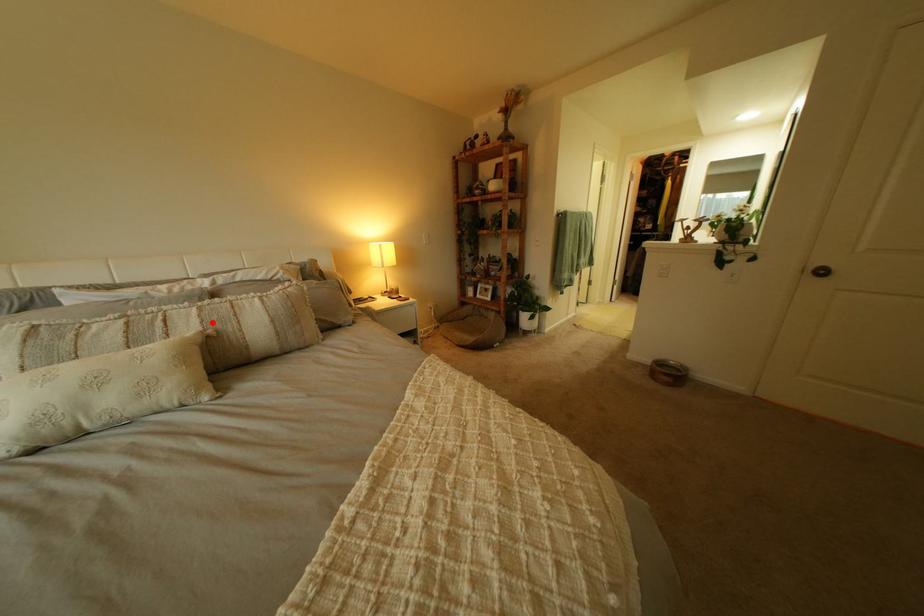
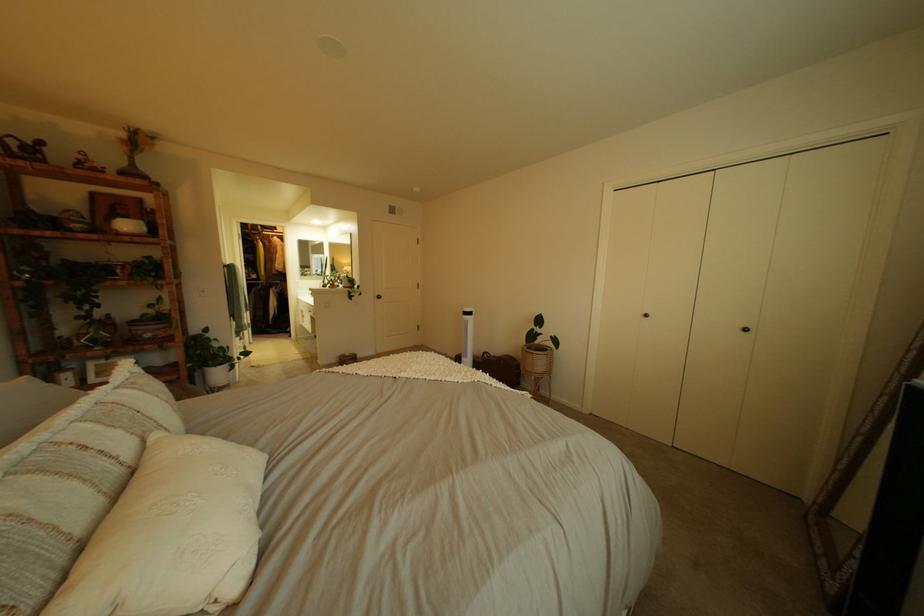
Find the pixel in the second image that matches the highlighted location in the first image.

(134, 434)